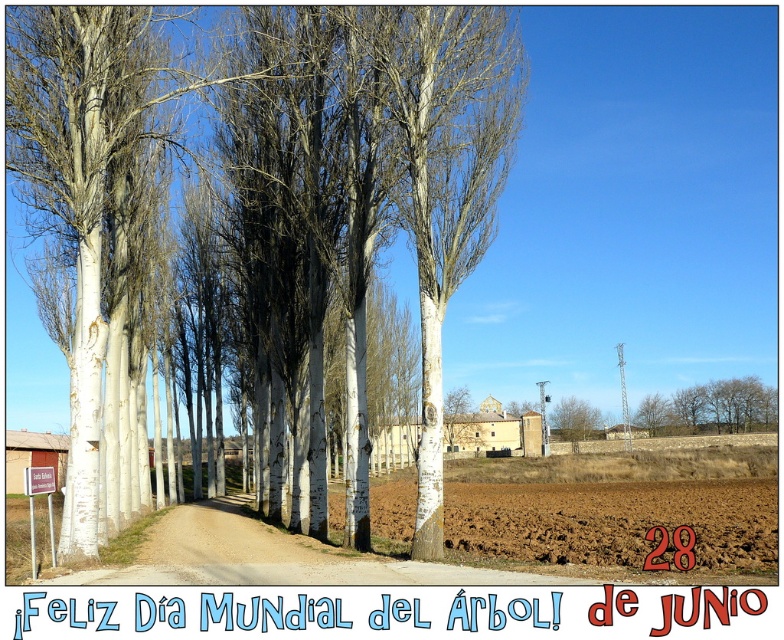
Question: Where is white smooth birch tree at center located in relation to white smooth trees at left in the image?

Choices:
 (A) below
 (B) above

Answer: (A)

Question: Which object is farther from the camera taking this photo?

Choices:
 (A) white smooth trees at left
 (B) white smooth birch tree at center

Answer: (B)

Question: Is white smooth birch tree at center positioned before white smooth trees at left?

Choices:
 (A) no
 (B) yes

Answer: (A)

Question: Among these points, which one is nearest to the camera?

Choices:
 (A) (490, 131)
 (B) (82, 269)

Answer: (B)

Question: Observing the image, what is the correct spatial positioning of white smooth birch tree at center in reference to white smooth trees at left?

Choices:
 (A) right
 (B) left

Answer: (A)